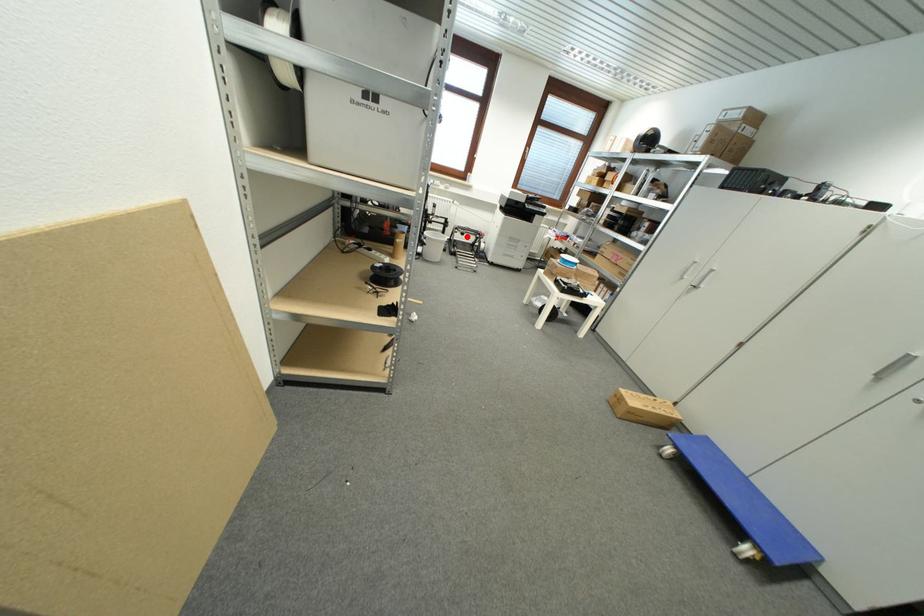
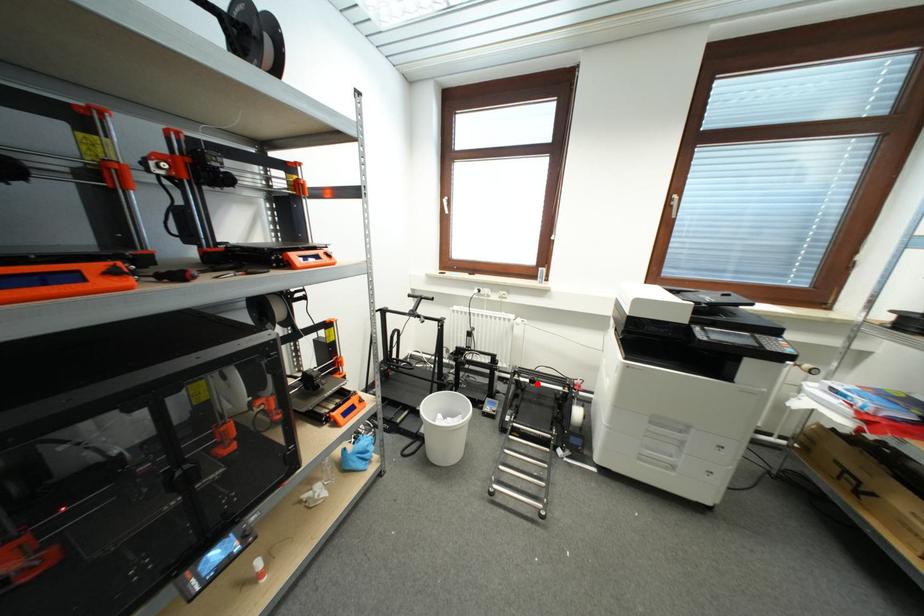
I am providing you with two images of the same scene from different viewpoints. A red point is marked on the first image and another point is marked on the second image. Are the points marked in image1 and image2 representing the same 3D position?

Yes